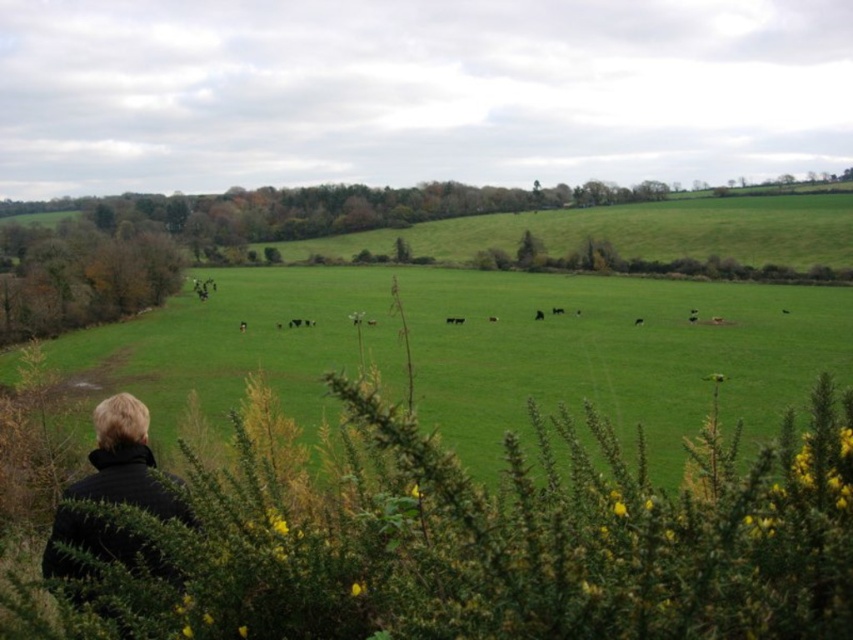
You are standing at the point with coordinates point (94, 486) and want to walk to the point with coordinates point (740, 417). Given the rural landscape described, will you have to walk through the pasture area to reach your destination?

Yes, you will have to walk through the pasture area to reach the point (740, 417) because it is located behind point (94, 486), which means it is further away in the midground where the pasture is situated.

You are a farmer standing on the black fabric at lower left and need to reach the green grass pasture at center to check on the cows. Can you walk directly to the pasture without any obstacles?

The distance between the black fabric at lower left and the green grass pasture at center is 119.49 meters. There are no obstacles mentioned in the scene description, so you can walk directly to the pasture.

The person in the scene wants to walk to the green grass pasture at center. Based on the coordinates provided, can you determine if the pasture is located to the left or right of the person?

The green grass pasture at center is located at coordinates point (614, 355), which places it to the right of the person since the x coordinate is greater than 0.5.